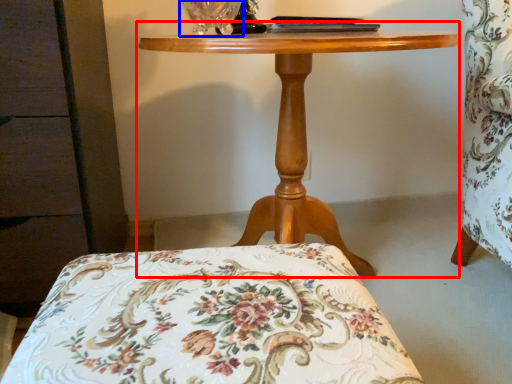
Question: Which object is further to the camera taking this photo, table (highlighted by a red box) or glass vase (highlighted by a blue box)?

Choices:
 (A) table
 (B) glass vase

Answer: (B)